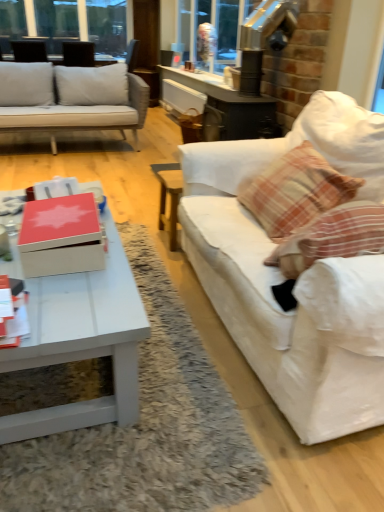
Question: Is clear glass window at upper left oriented away from white glossy coffee table at lower left?

Choices:
 (A) no
 (B) yes

Answer: (A)

Question: Is clear glass window at upper left shorter than white glossy coffee table at lower left?

Choices:
 (A) yes
 (B) no

Answer: (B)

Question: Is clear glass window at upper left oriented towards white glossy coffee table at lower left?

Choices:
 (A) no
 (B) yes

Answer: (B)

Question: Considering the relative sizes of clear glass window at upper left and white glossy coffee table at lower left in the image provided, is clear glass window at upper left bigger than white glossy coffee table at lower left?

Choices:
 (A) no
 (B) yes

Answer: (A)

Question: From the image's perspective, does clear glass window at upper left appear lower than white glossy coffee table at lower left?

Choices:
 (A) no
 (B) yes

Answer: (A)

Question: Is clear glass window at upper left further to the viewer compared to white glossy coffee table at lower left?

Choices:
 (A) no
 (B) yes

Answer: (B)

Question: Is matte red box at center outside of white glossy coffee table at lower left?

Choices:
 (A) yes
 (B) no

Answer: (A)

Question: Is matte red box at center oriented away from white glossy coffee table at lower left?

Choices:
 (A) yes
 (B) no

Answer: (B)

Question: Is matte red box at center at the left side of white glossy coffee table at lower left?

Choices:
 (A) yes
 (B) no

Answer: (B)

Question: From the image's perspective, is matte red box at center beneath white glossy coffee table at lower left?

Choices:
 (A) no
 (B) yes

Answer: (A)

Question: Can you confirm if matte red box at center is bigger than white glossy coffee table at lower left?

Choices:
 (A) yes
 (B) no

Answer: (B)

Question: Does matte red box at center have a greater height compared to white glossy coffee table at lower left?

Choices:
 (A) yes
 (B) no

Answer: (B)

Question: Is clear glass window at upper left at the back of matte red box at center?

Choices:
 (A) yes
 (B) no

Answer: (B)